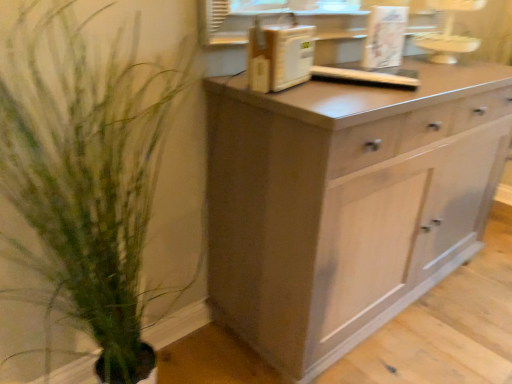
The height and width of the screenshot is (384, 512). What do you see at coordinates (346, 202) in the screenshot?
I see `matte gray cabinet at center` at bounding box center [346, 202].

Where is `white plastic microwave at upper center`? The width and height of the screenshot is (512, 384). white plastic microwave at upper center is located at coordinates (279, 57).

In order to face green leafy plant at left, should I rotate leftwards or rightwards?

It's best to rotate left around 19.721 degrees.

The image size is (512, 384). In order to click on matte gray cabinet at center in this screenshot , I will do click(x=346, y=202).

Which object is positioned more to the left, green leafy plant at left or matte gray cabinet at center?

green leafy plant at left is more to the left.

Looking at this image, from the image's perspective, would you say green leafy plant at left is positioned over matte gray cabinet at center?

Incorrect, from the image's perspective, green leafy plant at left is lower than matte gray cabinet at center.

Where is `the chest of drawers lying behind the green leafy plant at left`? the chest of drawers lying behind the green leafy plant at left is located at coordinates (346, 202).

In the scene shown: How different are the orientations of green leafy plant at left and matte gray cabinet at center in degrees?

There is a 0.118-degree angle between the facing directions of green leafy plant at left and matte gray cabinet at center.

Which object is further away from the camera taking this photo, matte gray cabinet at center or white plastic microwave at upper center?

Positioned behind is white plastic microwave at upper center.

Which of these two, matte gray cabinet at center or white plastic microwave at upper center, is wider?

With larger width is matte gray cabinet at center.

Is matte gray cabinet at center positioned beyond the bounds of white plastic microwave at upper center?

That's correct, matte gray cabinet at center is outside of white plastic microwave at upper center.

Is matte gray cabinet at center oriented away from white plastic microwave at upper center?

That's not correct — matte gray cabinet at center is not looking away from white plastic microwave at upper center.

Looking at the image, does white plastic microwave at upper center seem bigger or smaller compared to matte gray cabinet at center?

Clearly, white plastic microwave at upper center is smaller in size than matte gray cabinet at center.

Considering the relative sizes of white plastic microwave at upper center and matte gray cabinet at center in the image provided, is white plastic microwave at upper center shorter than matte gray cabinet at center?

Yes, white plastic microwave at upper center is shorter than matte gray cabinet at center.

Is white plastic microwave at upper center to the left or to the right of matte gray cabinet at center in the image?

Clearly, white plastic microwave at upper center is on the left of matte gray cabinet at center in the image.

Is white plastic microwave at upper center far away from matte gray cabinet at center?

white plastic microwave at upper center is actually quite close to matte gray cabinet at center.

Would you say green leafy plant at left is part of matte gray cabinet at center's contents?

Definitely not — green leafy plant at left is not inside matte gray cabinet at center.

Is matte gray cabinet at center not near green leafy plant at left?

No.

Is matte gray cabinet at center smaller than green leafy plant at left?

No, matte gray cabinet at center is not smaller than green leafy plant at left.

Is point (389, 224) positioned after point (186, 270)?

No, (389, 224) is in front of (186, 270).

Is green leafy plant at left positioned in front of white plastic microwave at upper center?

That is True.

Looking at this image, between green leafy plant at left and white plastic microwave at upper center, which one has smaller size?

white plastic microwave at upper center.

The image size is (512, 384). Identify the location of houseplant lying below the white plastic microwave at upper center (from the image's perspective). (97, 170).

Is white plastic microwave at upper center next to green leafy plant at left?

white plastic microwave at upper center is not next to green leafy plant at left, and they're not touching.

From a real-world perspective, is white plastic microwave at upper center over green leafy plant at left?

Yes.

Does point (309, 45) come closer to viewer compared to point (20, 70)?

No, (309, 45) is further to viewer.

Which of these two, white plastic microwave at upper center or green leafy plant at left, is thinner?

white plastic microwave at upper center.

Find the location of a particular element. chest of drawers above the green leafy plant at left (from the image's perspective) is located at coordinates [x=346, y=202].

In order to click on appliance above the matte gray cabinet at center (from a real-world perspective) in this screenshot , I will do `click(279, 57)`.

Looking at the image, which one is located further to matte gray cabinet at center, green leafy plant at left or white plastic microwave at upper center?

green leafy plant at left is positioned further to the anchor matte gray cabinet at center.

Looking at the image, which one is located closer to green leafy plant at left, white plastic microwave at upper center or matte gray cabinet at center?

The object closer to green leafy plant at left is matte gray cabinet at center.

When comparing their distances from green leafy plant at left, does matte gray cabinet at center or white plastic microwave at upper center seem further?

white plastic microwave at upper center is further to green leafy plant at left.

Looking at the image, which one is located further to white plastic microwave at upper center, green leafy plant at left or matte gray cabinet at center?

Among the two, green leafy plant at left is located further to white plastic microwave at upper center.

Looking at the image, which one is located closer to white plastic microwave at upper center, matte gray cabinet at center or green leafy plant at left?

matte gray cabinet at center is closer to white plastic microwave at upper center.

Considering their positions, is white plastic microwave at upper center positioned further to matte gray cabinet at center than green leafy plant at left?

green leafy plant at left is positioned further to the anchor matte gray cabinet at center.

Where is `appliance located between green leafy plant at left and matte gray cabinet at center in the left-right direction`? The image size is (512, 384). appliance located between green leafy plant at left and matte gray cabinet at center in the left-right direction is located at coordinates (279, 57).